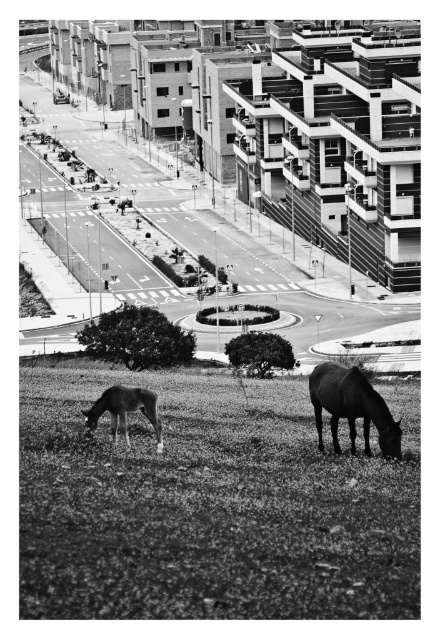
Question: Can you confirm if grassy field at lower center is wider than dark brown horse at lower right?

Choices:
 (A) no
 (B) yes

Answer: (B)

Question: Which point is farther from the camera taking this photo?

Choices:
 (A) (337, 369)
 (B) (138, 392)

Answer: (A)

Question: Does dark brown horse at lower right appear over smooth brown horse at lower left?

Choices:
 (A) yes
 (B) no

Answer: (B)

Question: Can you confirm if grassy field at lower center is positioned to the right of smooth brown horse at lower left?

Choices:
 (A) yes
 (B) no

Answer: (A)

Question: Which point is farther from the camera taking this photo?

Choices:
 (A) (132, 394)
 (B) (399, 420)

Answer: (B)

Question: Estimate the real-world distances between objects in this image. Which object is closer to the smooth brown horse at lower left?

Choices:
 (A) dark brown horse at lower right
 (B) grassy field at lower center

Answer: (B)